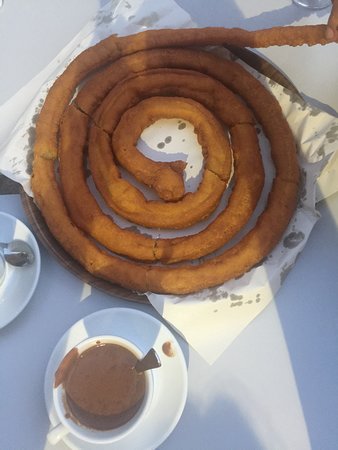
Find the location of a particular element. napkin is located at coordinates (195, 338).